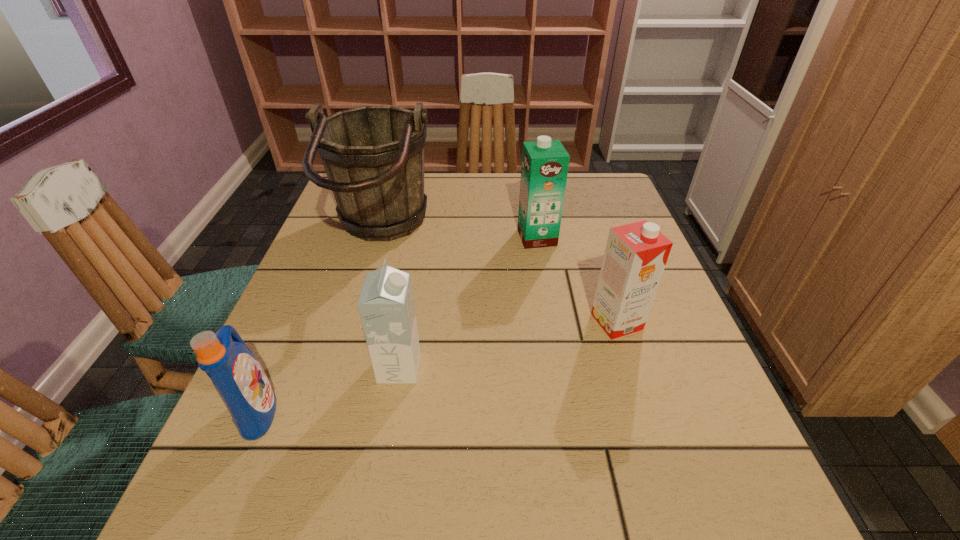
Locate an element on the screen. Image resolution: width=960 pixels, height=540 pixels. bucket is located at coordinates (373, 156).

Where is `the second carton from left to right`? This screenshot has width=960, height=540. the second carton from left to right is located at coordinates (545, 162).

Identify the location of the farthest carton. (545, 162).

The image size is (960, 540). Identify the location of the nearest carton. [386, 306].

The image size is (960, 540). What are the coordinates of `the third farthest object` in the screenshot? It's located at (636, 254).

Identify the location of the rightmost object. (636, 254).

Locate an element on the screen. detergent is located at coordinates (238, 377).

The image size is (960, 540). Identify the location of vacant space located on the handle side of the bucket. (584, 233).

What are the coordinates of `vacant point located 0.210m on the left of the second carton from right to left` in the screenshot? It's located at (434, 238).

This screenshot has width=960, height=540. I want to click on free region located 0.240m on the front label of the leftmost carton, so click(552, 368).